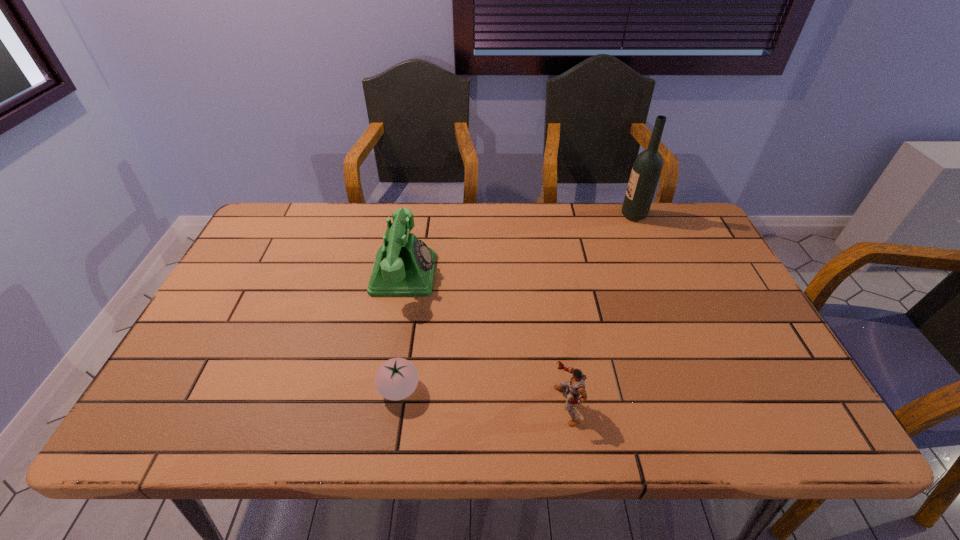
Find the location of a particular element. free space between the shortest object and the third shortest object is located at coordinates (401, 331).

Find the location of a particular element. Image resolution: width=960 pixels, height=540 pixels. empty location between the puncher and the rightmost object is located at coordinates (600, 310).

At what (x,y) coordinates should I click in order to perform the action: click on free area in between the second tallest object and the tomato. Please return your answer as a coordinate pair (x, y). This screenshot has width=960, height=540. Looking at the image, I should click on (401, 331).

What are the coordinates of `vacant region between the third nearest object and the puncher` in the screenshot? It's located at (485, 340).

The image size is (960, 540). Find the location of `vacant area that lies between the rightmost object and the second object from right to left`. vacant area that lies between the rightmost object and the second object from right to left is located at coordinates (600, 310).

Find the location of `vacant region between the tomato and the puncher`. vacant region between the tomato and the puncher is located at coordinates (483, 397).

Image resolution: width=960 pixels, height=540 pixels. I want to click on free space between the tallest object and the shortest object, so click(516, 302).

This screenshot has width=960, height=540. I want to click on object that is the second closest to the telephone, so click(x=576, y=386).

Where is `object that is the second closest to the second object from right to left`? The width and height of the screenshot is (960, 540). object that is the second closest to the second object from right to left is located at coordinates (404, 266).

The height and width of the screenshot is (540, 960). I want to click on vacant space that satisfies the following two spatial constraints: 1. on the dial of the shortest object; 2. on the left side of the telephone, so click(383, 389).